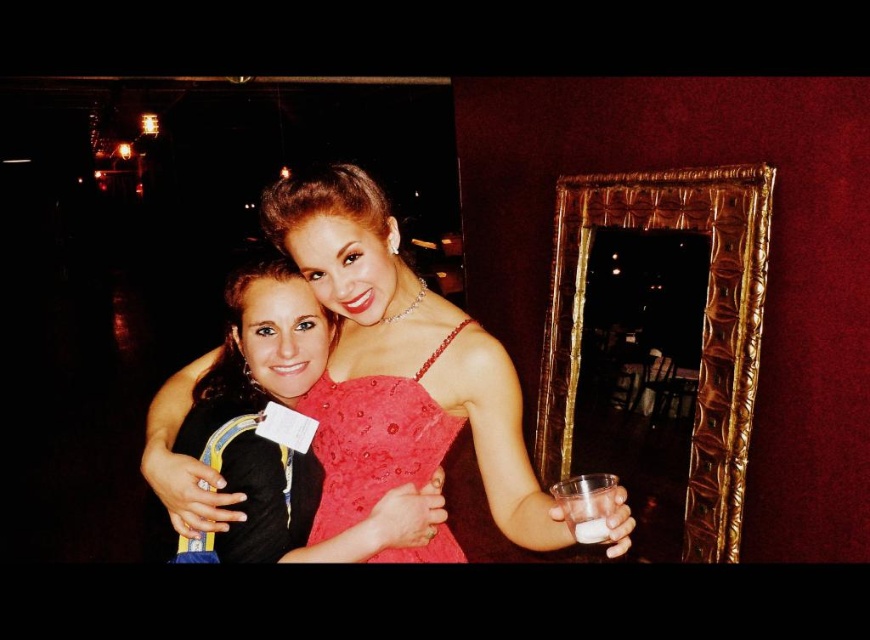
Which is below, shiny satin dress at center or translucent glass cup at center?

translucent glass cup at center is below.

Between shiny satin dress at center and translucent glass cup at center, which one appears on the right side from the viewer's perspective?

translucent glass cup at center is more to the right.

Does point (340, 448) lie behind point (604, 525)?

Yes, it is behind point (604, 525).

You are a GUI agent. You are given a task and a screenshot of the screen. Output one action in this format:
    pyautogui.click(x=<x>, y=<y>)
    Task: Click on the shiny satin dress at center
    Image resolution: width=870 pixels, height=640 pixels.
    Given the screenshot: What is the action you would take?
    click(373, 440)

Does matte red dress at center appear under translucent glass cup at center?

Incorrect, matte red dress at center is not positioned below translucent glass cup at center.

How distant is matte red dress at center from translucent glass cup at center?

matte red dress at center is 17.57 inches from translucent glass cup at center.

Which is in front, point (427, 557) or point (579, 529)?

Point (579, 529)

You are a GUI agent. You are given a task and a screenshot of the screen. Output one action in this format:
    pyautogui.click(x=<x>, y=<y>)
    Task: Click on the matte red dress at center
    This screenshot has width=870, height=640.
    Given the screenshot: What is the action you would take?
    pyautogui.click(x=399, y=365)

Which is below, matte red dress at center or clear plastic cup at right?

clear plastic cup at right

Does matte red dress at center appear on the left side of clear plastic cup at right?

Indeed, matte red dress at center is positioned on the left side of clear plastic cup at right.

The image size is (870, 640). I want to click on matte red dress at center, so click(x=399, y=365).